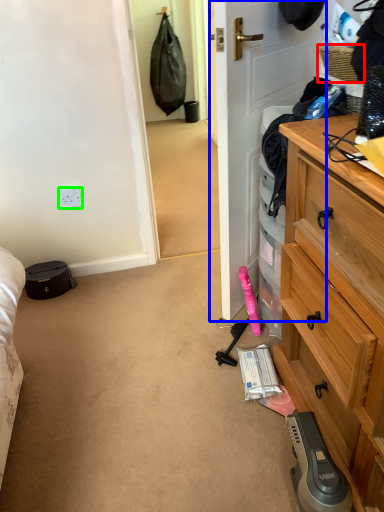
Question: Which object is positioned closest to picnic basket (highlighted by a red box)? Select from door (highlighted by a blue box) and power outlet (highlighted by a green box).

Choices:
 (A) door
 (B) power outlet

Answer: (A)